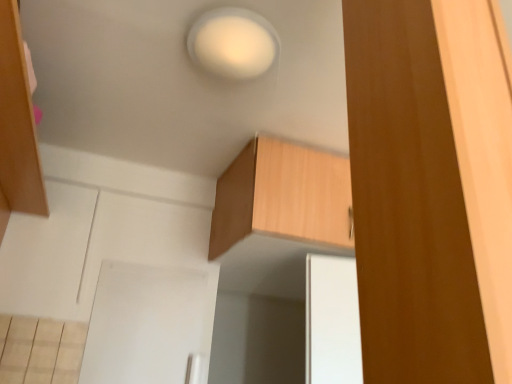
Question: Is white matte light at upper center inside brown wood cabinet at right, which is the 2th cabinetry in back-to-front order?

Choices:
 (A) yes
 (B) no

Answer: (B)

Question: Considering the relative sizes of brown wood cabinet at right, which is the 2th cabinetry in back-to-front order, and white matte light at upper center in the image provided, is brown wood cabinet at right, which is the 2th cabinetry in back-to-front order, thinner than white matte light at upper center?

Choices:
 (A) yes
 (B) no

Answer: (A)

Question: Does brown wood cabinet at right, the 1th cabinetry from the front, appear on the right side of white matte light at upper center?

Choices:
 (A) yes
 (B) no

Answer: (A)

Question: Is brown wood cabinet at right, which is the 2th cabinetry in back-to-front order, in front of white matte light at upper center?

Choices:
 (A) no
 (B) yes

Answer: (B)

Question: From a real-world perspective, does brown wood cabinet at right, the 1th cabinetry from the front, stand above white matte light at upper center?

Choices:
 (A) no
 (B) yes

Answer: (A)

Question: Is the surface of brown wood cabinet at right, the 1th cabinetry from the front, in direct contact with white matte light at upper center?

Choices:
 (A) no
 (B) yes

Answer: (A)

Question: Would you consider brown wood cabinet at right, which is the 2th cabinetry in back-to-front order, to be distant from wooden cabinet at upper center, which appears as the second cabinetry when viewed from the front?

Choices:
 (A) no
 (B) yes

Answer: (B)

Question: Considering the relative sizes of brown wood cabinet at right, the 1th cabinetry from the front, and wooden cabinet at upper center, which appears as the second cabinetry when viewed from the front, in the image provided, is brown wood cabinet at right, the 1th cabinetry from the front, smaller than wooden cabinet at upper center, which appears as the second cabinetry when viewed from the front,?

Choices:
 (A) yes
 (B) no

Answer: (A)

Question: Considering the relative sizes of brown wood cabinet at right, the 1th cabinetry from the front, and wooden cabinet at upper center, which is counted as the first cabinetry, starting from the back, in the image provided, is brown wood cabinet at right, the 1th cabinetry from the front, shorter than wooden cabinet at upper center, which is counted as the first cabinetry, starting from the back,?

Choices:
 (A) no
 (B) yes

Answer: (A)

Question: Would you say brown wood cabinet at right, which is the 2th cabinetry in back-to-front order, is outside wooden cabinet at upper center, which appears as the second cabinetry when viewed from the front?

Choices:
 (A) yes
 (B) no

Answer: (A)

Question: From a real-world perspective, is brown wood cabinet at right, the 1th cabinetry from the front, under wooden cabinet at upper center, which is counted as the first cabinetry, starting from the back?

Choices:
 (A) yes
 (B) no

Answer: (A)

Question: From the image's perspective, would you say brown wood cabinet at right, the 1th cabinetry from the front, is positioned over wooden cabinet at upper center, which is counted as the first cabinetry, starting from the back?

Choices:
 (A) no
 (B) yes

Answer: (B)

Question: Considering the relative sizes of wooden cabinet at upper center, which is counted as the first cabinetry, starting from the back, and brown wood cabinet at right, which is the 2th cabinetry in back-to-front order, in the image provided, is wooden cabinet at upper center, which is counted as the first cabinetry, starting from the back, wider than brown wood cabinet at right, which is the 2th cabinetry in back-to-front order,?

Choices:
 (A) no
 (B) yes

Answer: (B)